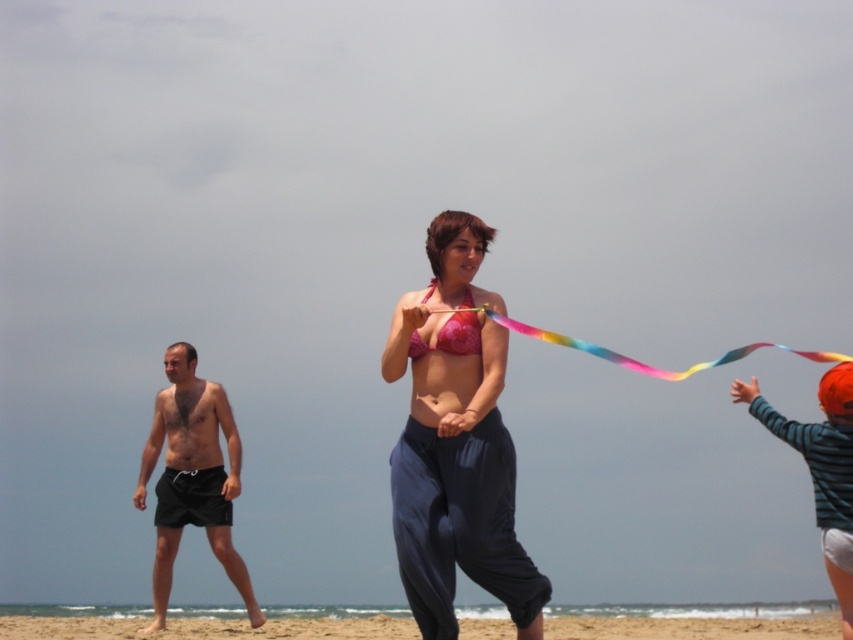
You are standing on the sandy beach at lower center and want to pick up the striped cotton shirt at right. Which direction should you move to reach it?

The striped cotton shirt at right is located above the sandy beach at lower center, so you should move upward to reach it.

You are a photographer on the beach and want to capture a photo where both the pink fabric bikini top at center and the black fabric shorts at left are visible. Based on their positions, which one should you focus on first to ensure both are in frame?

The pink fabric bikini top at center is above the black fabric shorts at left, so you should focus on the pink fabric bikini top at center first to ensure both are within the frame.

You are a photographer trying to capture the beach scene. You want to focus on the pink fabric bikini top at center and the black fabric shorts at left. Which object should you zoom in on first to ensure it appears larger in your photo?

The pink fabric bikini top at center is closer to the viewer than the black fabric shorts at left, so zoom in on the pink fabric bikini top at center first to make it appear larger in the photo.